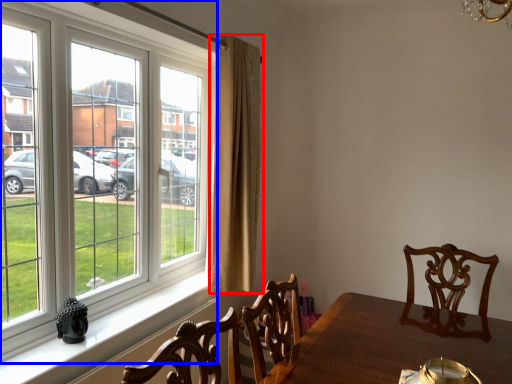
Question: Which object appears farthest to the camera in this image, curtain (highlighted by a red box) or window (highlighted by a blue box)?

Choices:
 (A) curtain
 (B) window

Answer: (A)